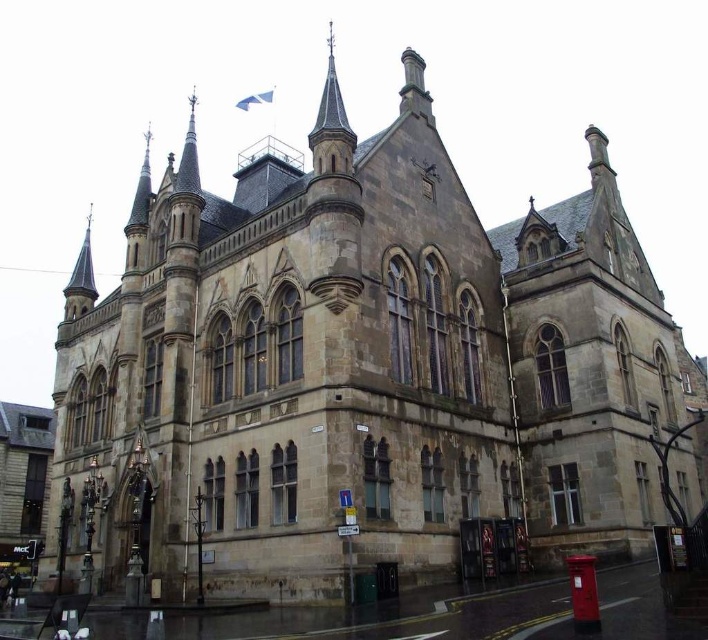
You are standing in front of the historic building and want to take a photo that includes both the dark brown stone spire at upper center and the smooth gray spire at upper left. Which spire should you position closer to the center of your camera frame to ensure both are visible in the shot?

The dark brown stone spire at upper center is closer to the viewer than the smooth gray spire at upper left, so you should position the dark brown stone spire at upper center closer to the center of your camera frame to ensure both are visible in the shot.

You are an architect analyzing the symmetry of the building in the image. The dark brown stone spire at upper center is located at coordinates 0.197, 0.469. Is this spire positioned exactly at the center of the building?

The dark brown stone spire at upper center is located at coordinates (331, 125), which does not align with the exact center of the building, so it is not positioned exactly at the center.